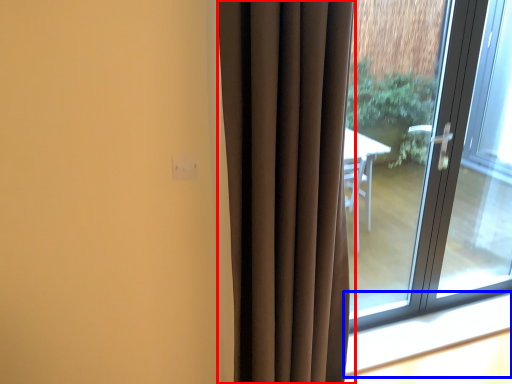
Question: Which object appears farthest to the camera in this image, curtain (highlighted by a red box) or window sill (highlighted by a blue box)?

Choices:
 (A) curtain
 (B) window sill

Answer: (B)